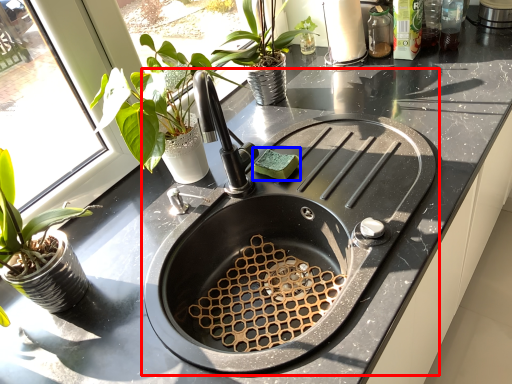
Question: Which object appears closest to the camera in this image, sink (highlighted by a red box) or food (highlighted by a blue box)?

Choices:
 (A) sink
 (B) food

Answer: (A)